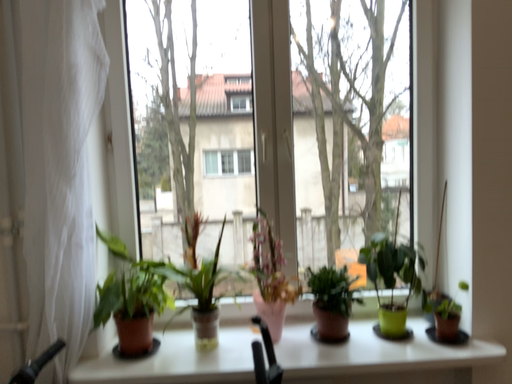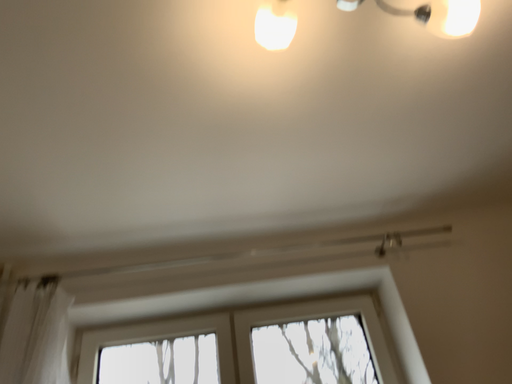
Question: How did the camera likely rotate when shooting the video?

Choices:
 (A) rotated downward
 (B) rotated upward

Answer: (B)